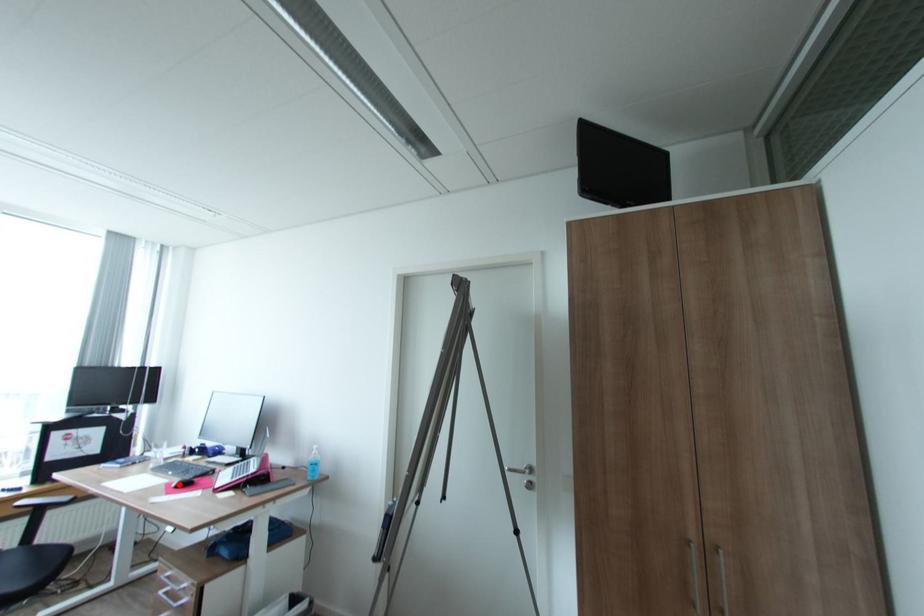
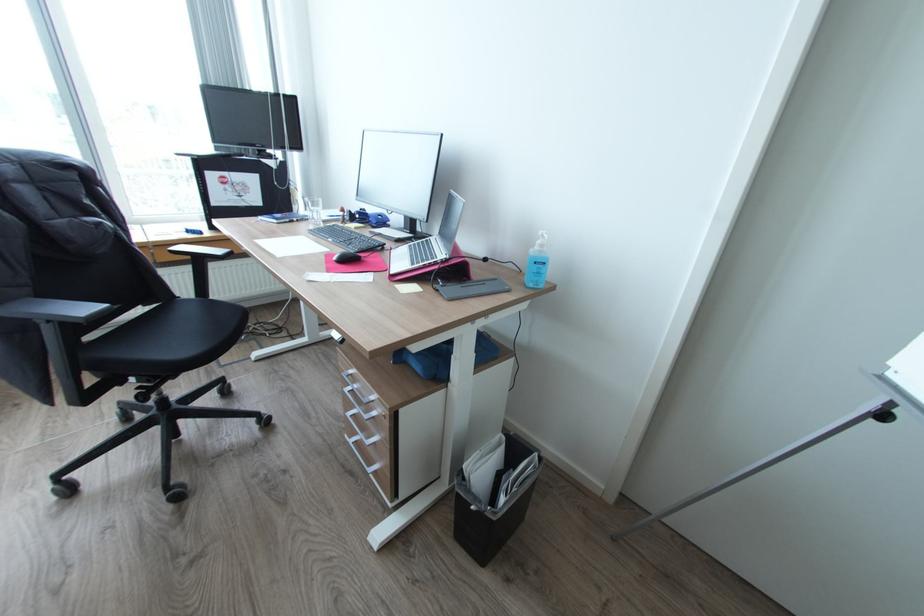
The point at the highlighted location is marked in the first image. Where is the corresponding point in the second image?

(339, 257)